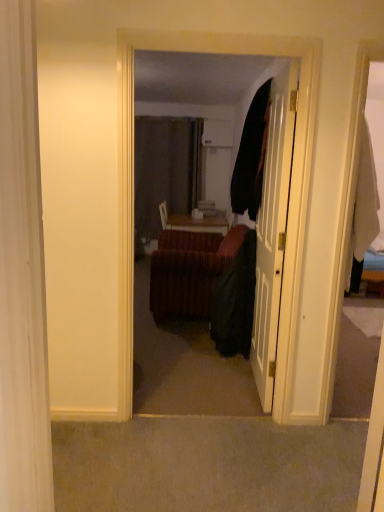
Question: Considering the relative sizes of velvet couch at center and black fabric robe at center in the image provided, is velvet couch at center wider than black fabric robe at center?

Choices:
 (A) no
 (B) yes

Answer: (A)

Question: Is velvet couch at center at the left side of black fabric robe at center?

Choices:
 (A) yes
 (B) no

Answer: (A)

Question: Does velvet couch at center have a greater height compared to black fabric robe at center?

Choices:
 (A) no
 (B) yes

Answer: (B)

Question: Is velvet couch at center shorter than black fabric robe at center?

Choices:
 (A) yes
 (B) no

Answer: (B)

Question: Can you confirm if velvet couch at center is smaller than black fabric robe at center?

Choices:
 (A) no
 (B) yes

Answer: (B)

Question: Based on their positions, is velvet couch at center located to the left or right of black fabric robe at center?

Choices:
 (A) left
 (B) right

Answer: (A)

Question: Looking at their shapes, would you say velvet couch at center is wider or thinner than black fabric robe at center?

Choices:
 (A) wide
 (B) thin

Answer: (B)

Question: From a real-world perspective, is velvet couch at center physically located above or below black fabric robe at center?

Choices:
 (A) below
 (B) above

Answer: (B)

Question: From the image's perspective, is velvet couch at center positioned above or below black fabric robe at center?

Choices:
 (A) below
 (B) above

Answer: (B)

Question: Is white glossy door at center in front of or behind velvet-like brown couch at center in the image?

Choices:
 (A) behind
 (B) front

Answer: (B)

Question: Considering the positions of white glossy door at center and velvet-like brown couch at center in the image, is white glossy door at center wider or thinner than velvet-like brown couch at center?

Choices:
 (A) wide
 (B) thin

Answer: (B)

Question: Is point (258, 312) closer or farther from the camera than point (228, 256)?

Choices:
 (A) closer
 (B) farther

Answer: (A)

Question: Is white glossy door at center inside or outside of velvet-like brown couch at center?

Choices:
 (A) inside
 (B) outside

Answer: (B)

Question: Based on their positions, is white glossy door at center located to the left or right of velvet couch at center?

Choices:
 (A) left
 (B) right

Answer: (B)

Question: From the image's perspective, is white glossy door at center positioned above or below velvet couch at center?

Choices:
 (A) below
 (B) above

Answer: (B)